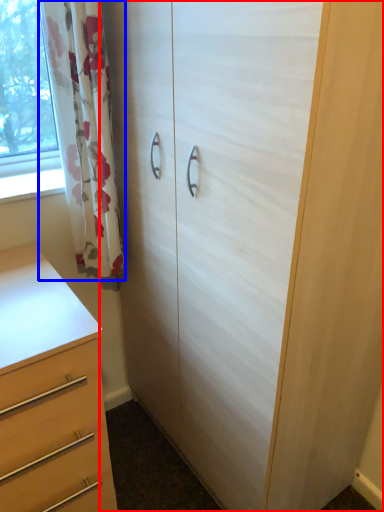
Question: Which object is further to the camera taking this photo, cupboard (highlighted by a red box) or curtain (highlighted by a blue box)?

Choices:
 (A) cupboard
 (B) curtain

Answer: (B)